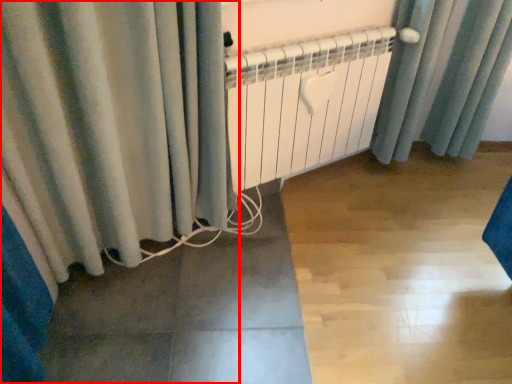
Question: Considering the relative positions of curtain (annotated by the red box) and radiator in the image provided, where is curtain (annotated by the red box) located with respect to the staircase?

Choices:
 (A) left
 (B) right

Answer: (A)